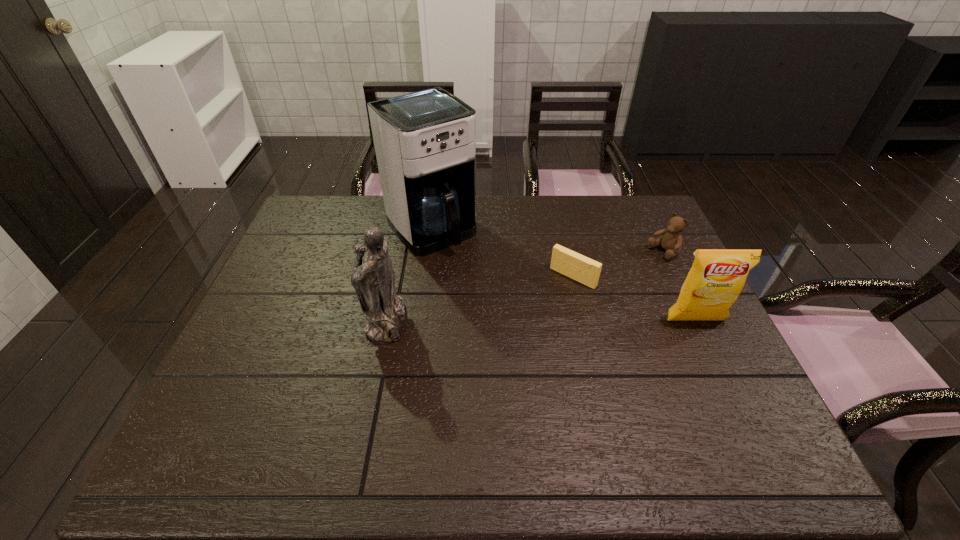
Find the location of a particular element. The height and width of the screenshot is (540, 960). crisp (potato chip) that is at the right edge is located at coordinates (717, 277).

Identify the location of teddy bear present at the right edge. (672, 240).

At what (x,y) coordinates should I click in order to perform the action: click on free space at the far edge. Please return your answer as a coordinate pair (x, y). The image size is (960, 540). Looking at the image, I should click on (519, 235).

This screenshot has width=960, height=540. In the image, there is a desktop. Identify the location of vacant region at the near edge. (320, 409).

Locate an element on the screen. The width and height of the screenshot is (960, 540). vacant space at the left edge of the desktop is located at coordinates (249, 380).

The image size is (960, 540). I want to click on vacant space at the right edge of the desktop, so click(x=665, y=287).

This screenshot has height=540, width=960. In order to click on free region at the far left corner of the desktop in this screenshot , I will do `click(327, 209)`.

You are a GUI agent. You are given a task and a screenshot of the screen. Output one action in this format:
    pyautogui.click(x=<x>, y=<y>)
    Task: Click on the vacant space at the near left corner
    
    Given the screenshot: What is the action you would take?
    pyautogui.click(x=208, y=394)

Identify the location of vacant space at the near right corner. The image size is (960, 540). (755, 420).

Where is `free space between the third nearest object and the teddy bear`? The height and width of the screenshot is (540, 960). free space between the third nearest object and the teddy bear is located at coordinates (618, 265).